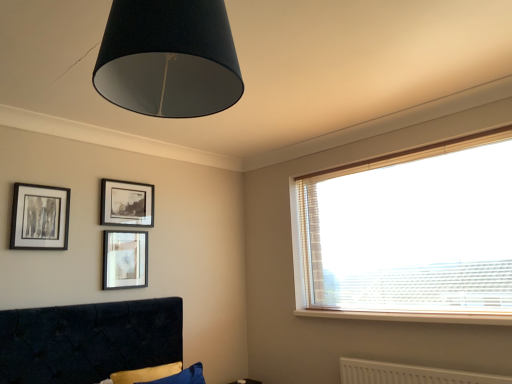
This screenshot has width=512, height=384. Describe the element at coordinates (408, 374) in the screenshot. I see `white textured radiator at lower right` at that location.

This screenshot has height=384, width=512. What do you see at coordinates (125, 259) in the screenshot?
I see `matte silver picture frame at center, acting as the 1th picture frame starting from the right` at bounding box center [125, 259].

I want to click on velvet dark blue bed at lower left, so click(88, 340).

The image size is (512, 384). In order to click on white glossy table at lower center in this screenshot , I will do `click(246, 381)`.

Is velvet dark blue bed at lower left smaller than matte silver picture frame at center, which is counted as the third picture frame, starting from the left?

No.

Would you say velvet dark blue bed at lower left is outside matte silver picture frame at center, acting as the 1th picture frame starting from the right?

velvet dark blue bed at lower left lies outside matte silver picture frame at center, acting as the 1th picture frame starting from the right,'s area.

From a real-world perspective, is velvet dark blue bed at lower left positioned over matte silver picture frame at center, which is counted as the third picture frame, starting from the left, based on gravity?

No, from a real-world perspective, velvet dark blue bed at lower left is not over matte silver picture frame at center, which is counted as the third picture frame, starting from the left

Could you tell me if translucent wood blinds at upper right is turned towards white glossy table at lower center?

No.

From the image's perspective, which one is positioned lower, translucent wood blinds at upper right or white glossy table at lower center?

white glossy table at lower center is shown below in the image.

Is translucent wood blinds at upper right further to the viewer compared to white glossy table at lower center?

No.

Is translucent wood blinds at upper right smaller than white glossy table at lower center?

Incorrect, translucent wood blinds at upper right is not smaller in size than white glossy table at lower center.

From a real-world perspective, is translucent wood blinds at upper right under white textured radiator at lower right?

Actually, translucent wood blinds at upper right is physically above white textured radiator at lower right in the real world.

Looking at this image, which of these two, translucent wood blinds at upper right or white textured radiator at lower right, is smaller?

white textured radiator at lower right is smaller.

Is translucent wood blinds at upper right not near white textured radiator at lower right?

No, there isn't a large distance between translucent wood blinds at upper right and white textured radiator at lower right.

Is translucent wood blinds at upper right not close to black glossy picture frame at upper center, acting as the 2th picture frame starting from the right?

Indeed, translucent wood blinds at upper right is not near black glossy picture frame at upper center, acting as the 2th picture frame starting from the right.

Is translucent wood blinds at upper right inside or outside of black glossy picture frame at upper center, the second picture frame viewed from the left?

translucent wood blinds at upper right is outside black glossy picture frame at upper center, the second picture frame viewed from the left.

From a real-world perspective, does translucent wood blinds at upper right sit lower than black glossy picture frame at upper center, acting as the 2th picture frame starting from the right?

Correct, in the physical world, translucent wood blinds at upper right is lower than black glossy picture frame at upper center, acting as the 2th picture frame starting from the right.

Does translucent wood blinds at upper right have a greater height compared to black glossy picture frame at upper center, the second picture frame viewed from the left?

Yes, translucent wood blinds at upper right is taller than black glossy picture frame at upper center, the second picture frame viewed from the left.

Could you tell me if matte black picture frame at upper left, marked as the 3th picture frame in a right-to-left arrangement, is facing black glossy picture frame at upper center, acting as the 2th picture frame starting from the right?

No, matte black picture frame at upper left, marked as the 3th picture frame in a right-to-left arrangement, is not turned towards black glossy picture frame at upper center, acting as the 2th picture frame starting from the right.

Where is `picture frame on the left of black glossy picture frame at upper center, acting as the 2th picture frame starting from the right`? The height and width of the screenshot is (384, 512). picture frame on the left of black glossy picture frame at upper center, acting as the 2th picture frame starting from the right is located at coordinates (40, 217).

Is point (69, 195) closer or farther from the camera than point (122, 223)?

Point (69, 195) is closer to the camera than point (122, 223).

Based on the photo, in the image, is matte black picture frame at upper left, the 1th picture frame in the left-to-right sequence, positioned in front of or behind black glossy picture frame at upper center, the second picture frame viewed from the left?

Visually, matte black picture frame at upper left, the 1th picture frame in the left-to-right sequence, is located in front of black glossy picture frame at upper center, the second picture frame viewed from the left.

Could you tell me if matte black picture frame at upper left, the 1th picture frame in the left-to-right sequence, is turned towards white glossy table at lower center?

No, matte black picture frame at upper left, the 1th picture frame in the left-to-right sequence, is not facing towards white glossy table at lower center.

Which point is more distant from viewer, (24, 198) or (240, 381)?

The point (240, 381) is more distant.

From the picture: Between matte black picture frame at upper left, marked as the 3th picture frame in a right-to-left arrangement, and black fabric lampshade at upper center, which one appears on the left side from the viewer's perspective?

From the viewer's perspective, matte black picture frame at upper left, marked as the 3th picture frame in a right-to-left arrangement, appears more on the left side.

From the image's perspective, which is above, matte black picture frame at upper left, marked as the 3th picture frame in a right-to-left arrangement, or black fabric lampshade at upper center?

From the image's view, black fabric lampshade at upper center is above.

From their relative heights in the image, would you say matte black picture frame at upper left, the 1th picture frame in the left-to-right sequence, is taller or shorter than black fabric lampshade at upper center?

Clearly, matte black picture frame at upper left, the 1th picture frame in the left-to-right sequence, is shorter compared to black fabric lampshade at upper center.

How many degrees apart are the facing directions of matte black picture frame at upper left, marked as the 3th picture frame in a right-to-left arrangement, and black fabric lampshade at upper center?

The facing directions of matte black picture frame at upper left, marked as the 3th picture frame in a right-to-left arrangement, and black fabric lampshade at upper center are 0.279 degrees apart.

You are a GUI agent. You are given a task and a screenshot of the screen. Output one action in this format:
    pyautogui.click(x=<x>, y=<y>)
    Task: Click on the 1st picture frame to the left of the velvet dark blue bed at lower left, counting from the anchor's position
    
    Given the screenshot: What is the action you would take?
    pyautogui.click(x=125, y=259)

Find the location of `window in front of the white glossy table at lower center`. window in front of the white glossy table at lower center is located at coordinates (411, 236).

Considering their positions, is matte black picture frame at upper left, the 1th picture frame in the left-to-right sequence, positioned further to white glossy table at lower center than translucent wood blinds at upper right?

matte black picture frame at upper left, the 1th picture frame in the left-to-right sequence, lies further to white glossy table at lower center than the other object.

Which object lies nearer to the anchor point velvet dark blue bed at lower left, black fabric lampshade at upper center or white glossy table at lower center?

The object closer to velvet dark blue bed at lower left is white glossy table at lower center.

Which object lies nearer to the anchor point white textured radiator at lower right, white wood window sill at lower right or velvet dark blue bed at lower left?

white wood window sill at lower right lies closer to white textured radiator at lower right than the other object.

From the image, which object appears to be farther from black fabric lampshade at upper center, translucent wood blinds at upper right or velvet dark blue bed at lower left?

Based on the image, translucent wood blinds at upper right appears to be further to black fabric lampshade at upper center.

Estimate the real-world distances between objects in this image. Which object is further from black fabric lampshade at upper center, translucent wood blinds at upper right or white textured radiator at lower right?

white textured radiator at lower right lies further to black fabric lampshade at upper center than the other object.

Based on their spatial positions, is velvet dark blue bed at lower left or matte black picture frame at upper left, marked as the 3th picture frame in a right-to-left arrangement, further from matte silver picture frame at center, acting as the 1th picture frame starting from the right?

matte black picture frame at upper left, marked as the 3th picture frame in a right-to-left arrangement, lies further to matte silver picture frame at center, acting as the 1th picture frame starting from the right, than the other object.

Which object lies further to the anchor point matte black picture frame at upper left, the 1th picture frame in the left-to-right sequence, white glossy table at lower center or matte silver picture frame at center, acting as the 1th picture frame starting from the right?

The object further to matte black picture frame at upper left, the 1th picture frame in the left-to-right sequence, is white glossy table at lower center.

Based on their spatial positions, is black fabric lampshade at upper center or matte silver picture frame at center, which is counted as the third picture frame, starting from the left, further from white wood window sill at lower right?

Among the two, black fabric lampshade at upper center is located further to white wood window sill at lower right.

Image resolution: width=512 pixels, height=384 pixels. Find the location of `bed between black fabric lampshade at upper center and white textured radiator at lower right in the vertical direction`. bed between black fabric lampshade at upper center and white textured radiator at lower right in the vertical direction is located at coordinates point(88,340).

Where is `bed situated between matte black picture frame at upper left, the 1th picture frame in the left-to-right sequence, and white textured radiator at lower right from left to right`? This screenshot has height=384, width=512. bed situated between matte black picture frame at upper left, the 1th picture frame in the left-to-right sequence, and white textured radiator at lower right from left to right is located at coordinates (88, 340).

I want to click on window sill situated between matte silver picture frame at center, which is counted as the third picture frame, starting from the left, and translucent wood blinds at upper right from left to right, so click(411, 316).

Locate an element on the screen. The image size is (512, 384). lamp between matte black picture frame at upper left, the 1th picture frame in the left-to-right sequence, and white textured radiator at lower right, in the horizontal direction is located at coordinates (168, 58).